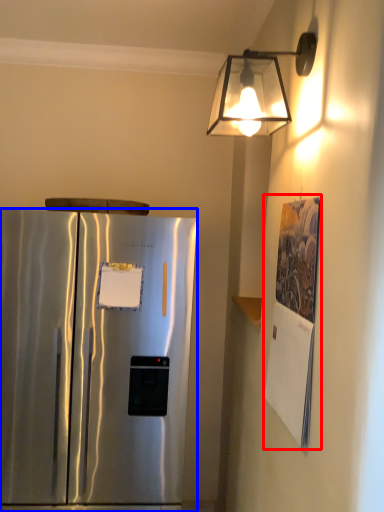
Question: Which point is closer to the camera, poster (highlighted by a red box) or refrigerator (highlighted by a blue box)?

Choices:
 (A) poster
 (B) refrigerator

Answer: (A)